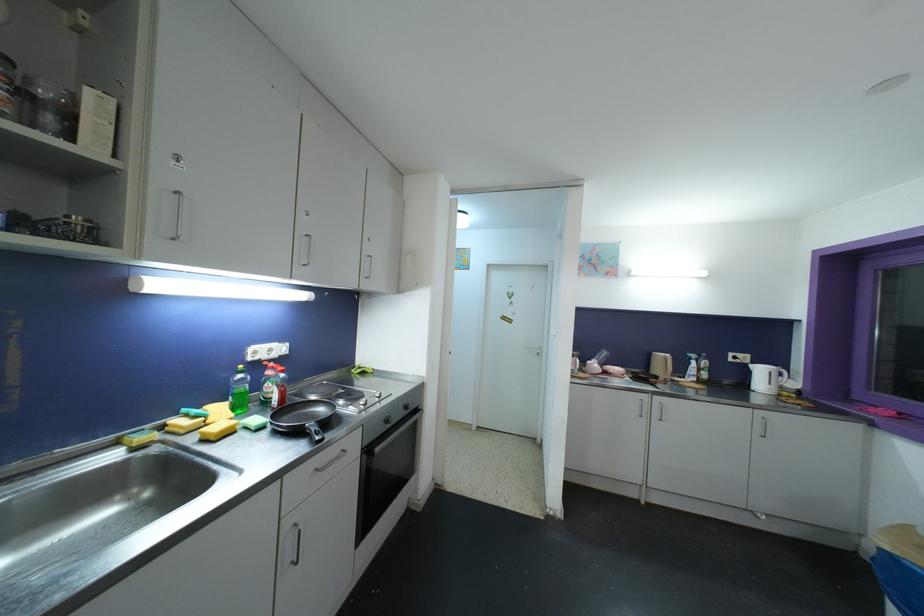
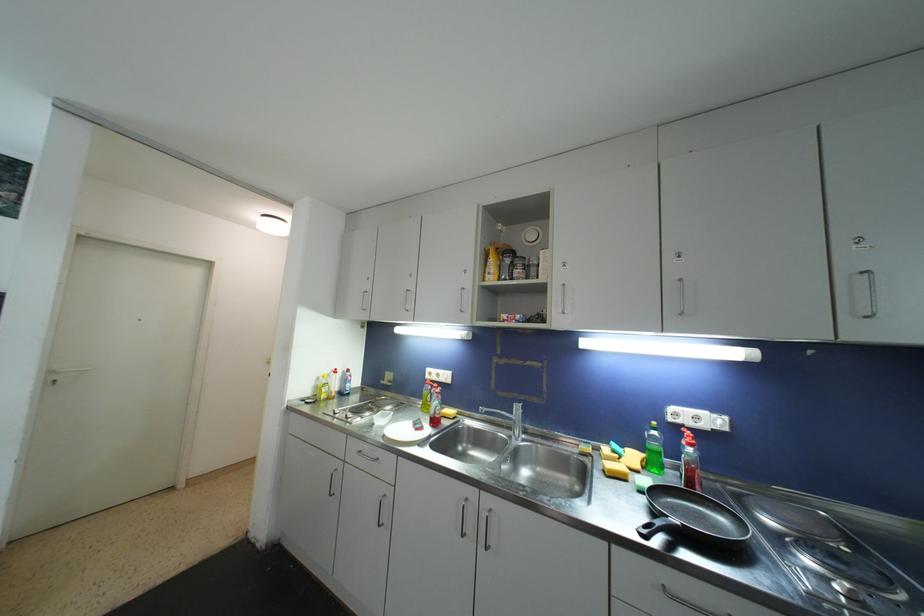
The point at (205, 444) is marked in the first image. Where is the corresponding point in the second image?

(608, 474)